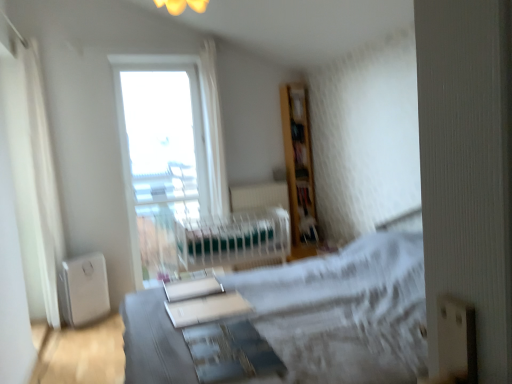
Question: Is green fabric hospital bed at center spatially inside transparent glass window at upper center, or outside of it?

Choices:
 (A) inside
 (B) outside

Answer: (B)

Question: From their relative heights in the image, would you say green fabric hospital bed at center is taller or shorter than transparent glass window at upper center?

Choices:
 (A) tall
 (B) short

Answer: (B)

Question: Considering the real-world distances, which object is farthest from the wooden bookshelf at upper right?

Choices:
 (A) transparent glass window at upper center
 (B) green fabric hospital bed at center
 (C) white sheer curtain at left
 (D) white plastic air purifier at lower left

Answer: (D)

Question: Considering the real-world distances, which object is closest to the white plastic air purifier at lower left?

Choices:
 (A) transparent glass window at upper center
 (B) green fabric hospital bed at center
 (C) white sheer curtain at left
 (D) wooden bookshelf at upper right

Answer: (C)